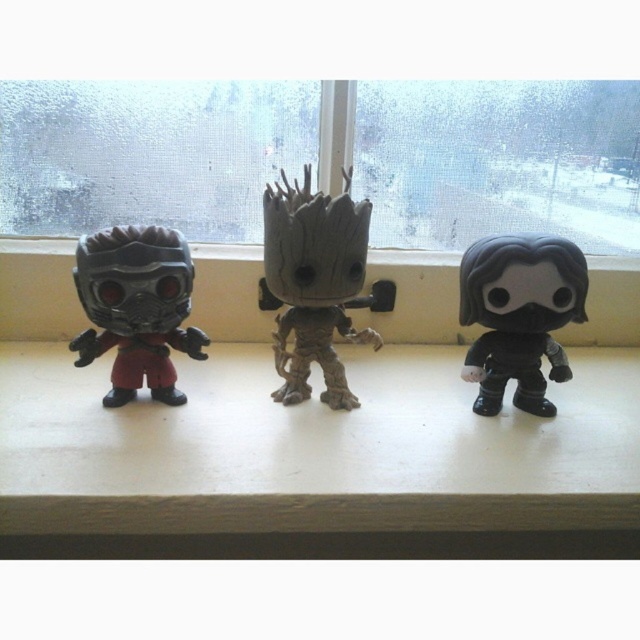
Question: In this image, where is frosted glass window at center located relative to black matte figure at right?

Choices:
 (A) left
 (B) right

Answer: (A)

Question: Which point is closer to the camera?

Choices:
 (A) gray textured tree man at center
 (B) matte plastic window sill at center
 (C) black matte figure at right

Answer: (B)

Question: Which of the following is the closest to the observer?

Choices:
 (A) (182, 220)
 (B) (282, 234)
 (C) (410, 464)
 (D) (500, 364)

Answer: (C)

Question: Which object is the farthest from the frosted glass window at center?

Choices:
 (A) gray textured tree man at center
 (B) matte black figure at left

Answer: (B)

Question: Is frosted glass window at center positioned before matte black figure at left?

Choices:
 (A) yes
 (B) no

Answer: (B)

Question: Does matte plastic window sill at center appear over frosted glass window at center?

Choices:
 (A) yes
 (B) no

Answer: (B)